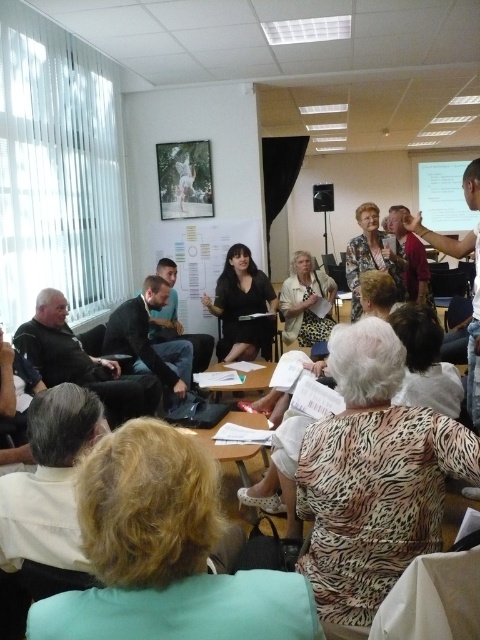
Is leopard print blouse at center in front of white paperboard at center?

Yes, leopard print blouse at center is in front of white paperboard at center.

Based on the photo, does leopard print blouse at center have a smaller size compared to white paperboard at center?

Yes, leopard print blouse at center is smaller than white paperboard at center.

Who is more forward, (386, 529) or (229, 236)?

Point (386, 529) is in front.

Where is `leopard print blouse at center`? This screenshot has height=640, width=480. leopard print blouse at center is located at coordinates (373, 476).

Who is lower down, plaid fabric shirt at center or matte black microphone at center?

plaid fabric shirt at center

Does plaid fabric shirt at center have a greater width compared to matte black microphone at center?

Yes.

Identify the location of plaid fabric shirt at center. (371, 257).

Can you confirm if black matte dress at center is positioned to the left of plaid fabric shirt at center?

Correct, you'll find black matte dress at center to the left of plaid fabric shirt at center.

Between point (240, 268) and point (347, 256), which one is positioned in front?

Point (347, 256) is in front.

Where is `black matte dress at center`? This screenshot has width=480, height=640. black matte dress at center is located at coordinates point(241,307).